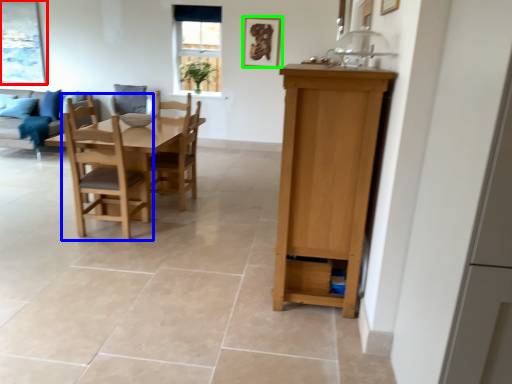
Question: Considering the real-world distances, which object is farthest from picture frame (highlighted by a red box)? chair (highlighted by a blue box) or picture frame (highlighted by a green box)?

Choices:
 (A) chair
 (B) picture frame

Answer: (A)